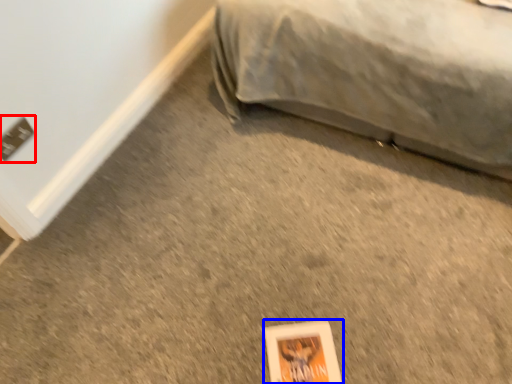
Question: Among these objects, which one is nearest to the camera, electric outlet (highlighted by a red box) or paperback book (highlighted by a blue box)?

Choices:
 (A) electric outlet
 (B) paperback book

Answer: (B)